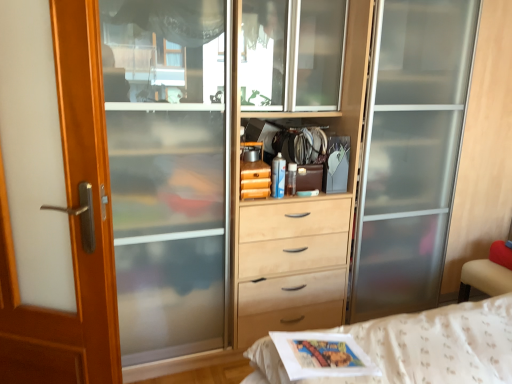
Question: Considering the positions of wooden door at left and matte gray magazine at center in the image, is wooden door at left taller or shorter than matte gray magazine at center?

Choices:
 (A) short
 (B) tall

Answer: (B)

Question: Is wooden door at left to the left or to the right of matte gray magazine at center in the image?

Choices:
 (A) right
 (B) left

Answer: (B)

Question: Does point (62, 140) appear closer or farther from the camera than point (340, 150)?

Choices:
 (A) closer
 (B) farther

Answer: (A)

Question: Considering the relative positions of matte gray magazine at center and wooden door at left in the image provided, is matte gray magazine at center to the left or to the right of wooden door at left?

Choices:
 (A) right
 (B) left

Answer: (A)

Question: From a real-world perspective, is matte gray magazine at center physically located above or below wooden door at left?

Choices:
 (A) above
 (B) below

Answer: (A)

Question: From the image's perspective, is matte gray magazine at center above or below wooden door at left?

Choices:
 (A) below
 (B) above

Answer: (B)

Question: Considering the positions of matte gray magazine at center and wooden door at left in the image, is matte gray magazine at center wider or thinner than wooden door at left?

Choices:
 (A) thin
 (B) wide

Answer: (B)